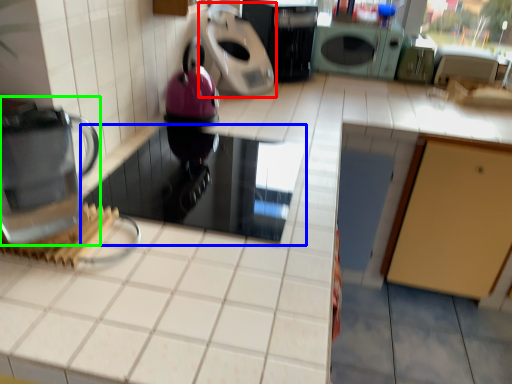
Question: Considering the real-world distances, which object is farthest from kitchen appliance (highlighted by a red box)? appliance (highlighted by a blue box) or home appliance (highlighted by a green box)?

Choices:
 (A) appliance
 (B) home appliance

Answer: (B)